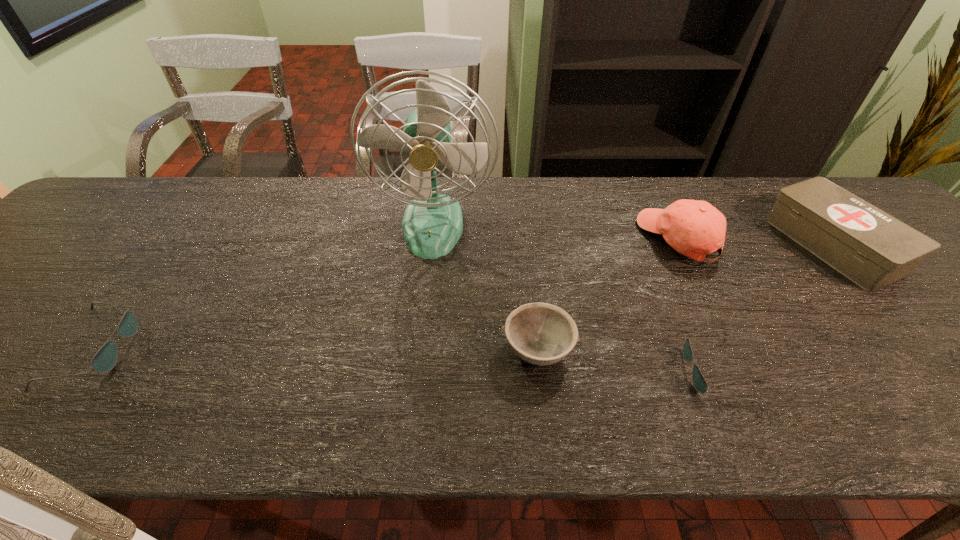
I want to click on the fifth tallest object, so click(105, 359).

Identify the location of the leftmost object. (105, 359).

Identify the location of the shortest object. The height and width of the screenshot is (540, 960). (699, 382).

The width and height of the screenshot is (960, 540). I want to click on the right sunglasses, so click(699, 382).

Locate an element on the screen. the tallest object is located at coordinates (432, 224).

Identify the location of the rightmost object. This screenshot has width=960, height=540. (873, 249).

This screenshot has height=540, width=960. I want to click on the third tallest object, so click(x=873, y=249).

At what (x,y) coordinates should I click in order to perform the action: click on the second tallest object. Please return your answer as a coordinate pair (x, y). Looking at the image, I should click on (694, 228).

The height and width of the screenshot is (540, 960). What are the coordinates of `bowl` in the screenshot? It's located at (542, 334).

This screenshot has height=540, width=960. What are the coordinates of `free space located on the lenses of the left sunglasses` in the screenshot? It's located at pyautogui.click(x=185, y=349).